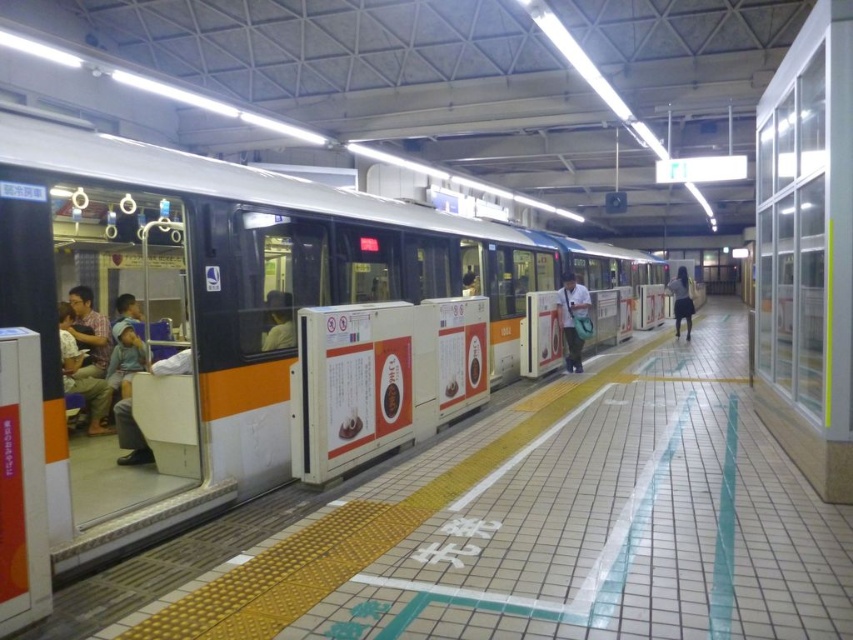
Question: Which of the following is the farthest from the observer?

Choices:
 (A) matte gray shirt at center
 (B) white fabric bag at center
 (C) matte black shirt at left
 (D) matte orange seat at left

Answer: (B)

Question: Among these objects, which one is nearest to the camera?

Choices:
 (A) matte gray shirt at center
 (B) white fabric bag at center
 (C) matte orange seat at left

Answer: (A)

Question: Which of the following is the closest to the observer?

Choices:
 (A) dark blue skirt at center
 (B) matte black shirt at left
 (C) white fabric bag at center

Answer: (B)

Question: Does matte black shirt at left appear on the left side of matte gray shirt at center?

Choices:
 (A) yes
 (B) no

Answer: (A)

Question: Does white fabric bag at center have a lesser width compared to dark blue skirt at center?

Choices:
 (A) yes
 (B) no

Answer: (A)

Question: Considering the relative positions of matte orange seat at left and matte gray shirt at center in the image provided, where is matte orange seat at left located with respect to matte gray shirt at center?

Choices:
 (A) below
 (B) above

Answer: (A)